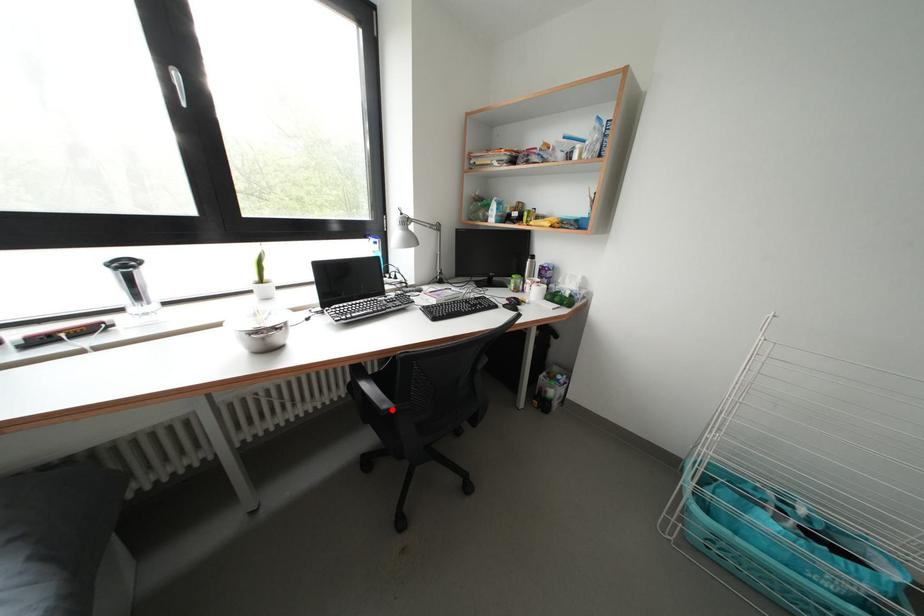
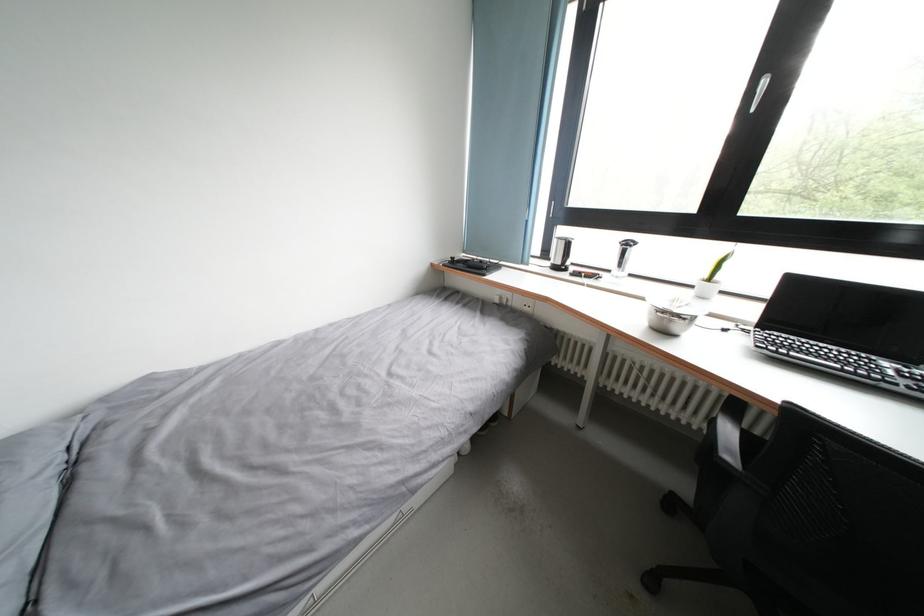
Where in the second image is the point corresponding to the highlighted location from the first image?

(736, 462)